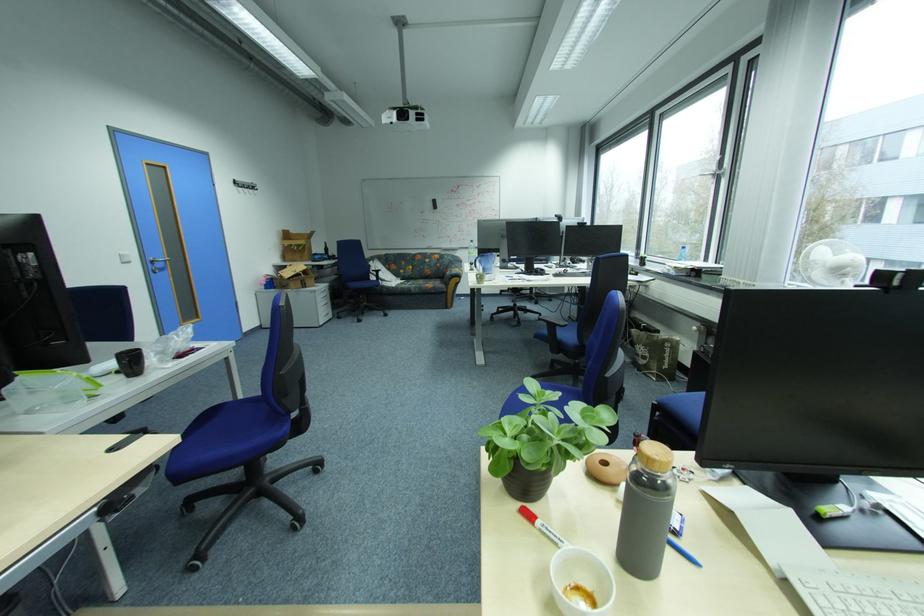
Find where to push the white light switch. Please return your answer as a coordinate pair (x, y).

(124, 257)